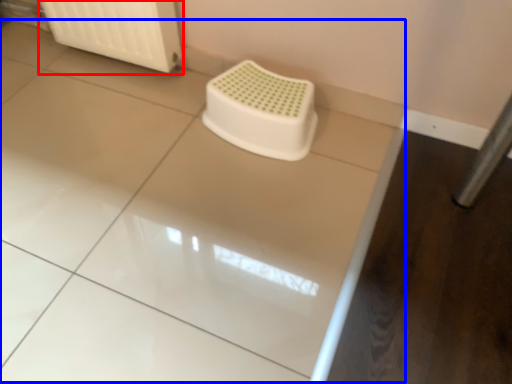
Question: Which object appears closest to the camera in this image, radiator (highlighted by a red box) or counter top (highlighted by a blue box)?

Choices:
 (A) radiator
 (B) counter top

Answer: (B)